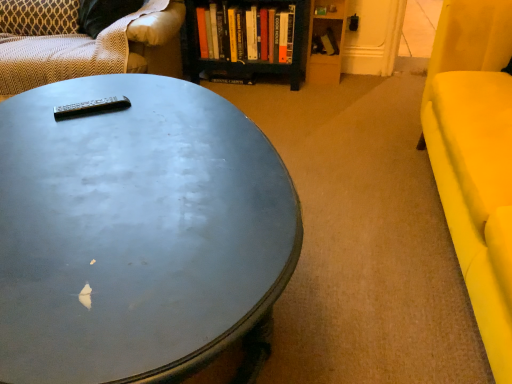
Identify the location of vacant space that is in between matte yellow armchair at right and metallic gray coffee table at center. (362, 228).